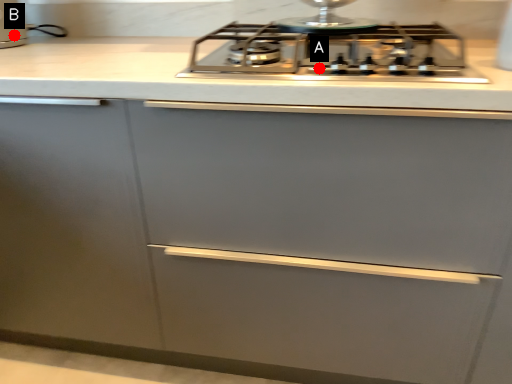
Question: Two points are circled on the image, labeled by A and B beside each circle. Which point is closer to the camera?

Choices:
 (A) A is closer
 (B) B is closer

Answer: (A)